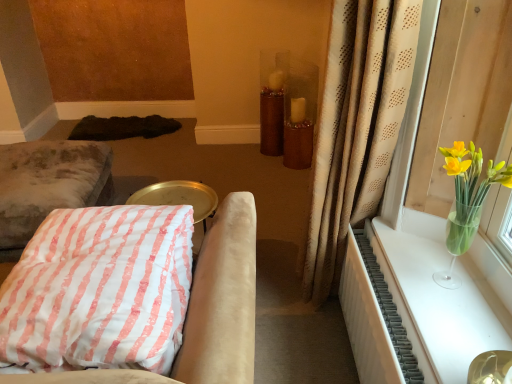
Locate an element on the screen. The height and width of the screenshot is (384, 512). brown glittery vase at center is located at coordinates (271, 121).

What do you see at coordinates (467, 200) in the screenshot?
I see `translucent glass vase at upper right` at bounding box center [467, 200].

Describe the element at coordinates (418, 309) in the screenshot. I see `white textured radiator at right` at that location.

Identify the location of beige dotted curtain at right. (357, 126).

From a real-world perspective, is translucent glass vase at upper right under dark brown shaggy rug at lower left?

No, from a real-world perspective, translucent glass vase at upper right is not beneath dark brown shaggy rug at lower left.

Looking at the image, does translucent glass vase at upper right seem bigger or smaller compared to dark brown shaggy rug at lower left?

Clearly, translucent glass vase at upper right is smaller in size than dark brown shaggy rug at lower left.

How many degrees apart are the facing directions of translucent glass vase at upper right and dark brown shaggy rug at lower left?

They differ by 86.5 degrees in their facing directions.

Is dark brown shaggy rug at lower left completely or partially inside translucent glass vase at upper right?

No, translucent glass vase at upper right does not contain dark brown shaggy rug at lower left.

Considering the relative positions of dark brown shaggy rug at lower left and pink striped fabric cushion at lower left, which is counted as the second furniture, starting from the back, in the image provided, is dark brown shaggy rug at lower left to the right of pink striped fabric cushion at lower left, which is counted as the second furniture, starting from the back, from the viewer's perspective?

No, dark brown shaggy rug at lower left is not to the right of pink striped fabric cushion at lower left, which is counted as the second furniture, starting from the back.

Is dark brown shaggy rug at lower left taller than pink striped fabric cushion at lower left, which is counted as the second furniture, starting from the back?

Incorrect, the height of dark brown shaggy rug at lower left is not larger of that of pink striped fabric cushion at lower left, which is counted as the second furniture, starting from the back.

Is dark brown shaggy rug at lower left positioned beyond the bounds of pink striped fabric cushion at lower left, the first furniture when ordered from right to left?

Absolutely, dark brown shaggy rug at lower left is external to pink striped fabric cushion at lower left, the first furniture when ordered from right to left.

Which object is thinner, dark brown shaggy rug at lower left or pink striped fabric cushion at lower left, which is the second furniture from left to right?

pink striped fabric cushion at lower left, which is the second furniture from left to right.

Identify the location of mat lying above the translucent glass vase at upper right (from the image's perspective). The image size is (512, 384). (123, 127).

From the image's perspective, which is above, dark brown shaggy rug at lower left or translucent glass vase at upper right?

From the image's view, dark brown shaggy rug at lower left is above.

Which of these two, dark brown shaggy rug at lower left or translucent glass vase at upper right, is smaller?

translucent glass vase at upper right.

Considering the positions of objects dark brown shaggy rug at lower left and translucent glass vase at upper right in the image provided, who is more to the left, dark brown shaggy rug at lower left or translucent glass vase at upper right?

From the viewer's perspective, dark brown shaggy rug at lower left appears more on the left side.

Is beige dotted curtain at right to the right of pink striped fabric cushion at lower left, the first furniture when ordered from right to left, from the viewer's perspective?

Correct, you'll find beige dotted curtain at right to the right of pink striped fabric cushion at lower left, the first furniture when ordered from right to left.

Is beige dotted curtain at right touching pink striped fabric cushion at lower left, which is the second furniture from left to right?

No, beige dotted curtain at right is not in contact with pink striped fabric cushion at lower left, which is the second furniture from left to right.

Considering the points (353, 63) and (117, 377), which point is in front, point (353, 63) or point (117, 377)?

The point (117, 377) is more forward.

Which object is thinner, beige dotted curtain at right or pink striped fabric cushion at lower left, the first furniture when ordered from right to left?

Thinner between the two is beige dotted curtain at right.

Which of these two, white textured radiator at right or dark brown shaggy rug at lower left, is thinner?

Thinner between the two is white textured radiator at right.

From a real-world perspective, is white textured radiator at right on dark brown shaggy rug at lower left?

Yes.

Is dark brown shaggy rug at lower left completely or partially inside white textured radiator at right?

No, dark brown shaggy rug at lower left is located outside of white textured radiator at right.

Considering the relative sizes of white textured radiator at right and dark brown shaggy rug at lower left in the image provided, is white textured radiator at right smaller than dark brown shaggy rug at lower left?

Yes, white textured radiator at right is smaller than dark brown shaggy rug at lower left.

From a real-world perspective, does translucent glass vase at upper right sit lower than beige dotted curtain at right?

No, from a real-world perspective, translucent glass vase at upper right is not beneath beige dotted curtain at right.

This screenshot has width=512, height=384. In order to click on floral arrangement in front of the beige dotted curtain at right in this screenshot , I will do `click(467, 200)`.

From the image's perspective, does translucent glass vase at upper right appear lower than beige dotted curtain at right?

Indeed, from the image's perspective, translucent glass vase at upper right is shown beneath beige dotted curtain at right.

Which object is wider, translucent glass vase at upper right or beige dotted curtain at right?

With larger width is beige dotted curtain at right.

Are translucent glass vase at upper right and pink striped fabric cushion at lower left, the first furniture in the front-to-back sequence, making contact?

No, translucent glass vase at upper right is not next to pink striped fabric cushion at lower left, the first furniture in the front-to-back sequence.

From the picture: Is translucent glass vase at upper right to the left or to the right of pink striped fabric cushion at lower left, the first furniture in the front-to-back sequence, in the image?

Clearly, translucent glass vase at upper right is on the right of pink striped fabric cushion at lower left, the first furniture in the front-to-back sequence, in the image.

Could you tell me if translucent glass vase at upper right is facing pink striped fabric cushion at lower left, the first furniture when ordered from right to left?

Yes, translucent glass vase at upper right is facing pink striped fabric cushion at lower left, the first furniture when ordered from right to left.

Who is shorter, translucent glass vase at upper right or pink striped fabric cushion at lower left, the first furniture when ordered from right to left?

pink striped fabric cushion at lower left, the first furniture when ordered from right to left.

Locate an element on the screen. floral arrangement located in front of the dark brown shaggy rug at lower left is located at coordinates (467, 200).

The width and height of the screenshot is (512, 384). Identify the location of the 2nd furniture below the dark brown shaggy rug at lower left (from the image's perspective). (205, 310).

From the image, which object appears to be nearer to beige dotted curtain at right, white textured radiator at right or translucent glass vase at upper right?

translucent glass vase at upper right lies closer to beige dotted curtain at right than the other object.

Which object lies further to the anchor point white textured radiator at right, velvet cushion at left, the second furniture when ordered from right to left, or pink striped fabric cushion at lower left, which is the second furniture from left to right?

The object further to white textured radiator at right is velvet cushion at left, the second furniture when ordered from right to left.

From the image, which object appears to be nearer to pink striped fabric cushion at lower left, the first furniture when ordered from right to left, beige dotted curtain at right or translucent glass vase at upper right?

The object closer to pink striped fabric cushion at lower left, the first furniture when ordered from right to left, is beige dotted curtain at right.

From the image, which object appears to be farther from white textured radiator at right, pink striped fabric cushion at lower left, the first furniture in the front-to-back sequence, or translucent glass vase at upper right?

The object further to white textured radiator at right is pink striped fabric cushion at lower left, the first furniture in the front-to-back sequence.

When comparing their distances from white textured radiator at right, does dark brown shaggy rug at lower left or beige dotted curtain at right seem further?

dark brown shaggy rug at lower left.

Estimate the real-world distances between objects in this image. Which object is further from white textured radiator at right, translucent glass vase at upper right or velvet cushion at left, placed as the second furniture when sorted from front to back?

Among the two, velvet cushion at left, placed as the second furniture when sorted from front to back, is located further to white textured radiator at right.

Considering their positions, is dark brown shaggy rug at lower left positioned closer to brown glittery vase at center than beige dotted curtain at right?

Among the two, dark brown shaggy rug at lower left is located nearer to brown glittery vase at center.

When comparing their distances from beige dotted curtain at right, does translucent glass vase at upper right or velvet cushion at left, the second furniture when ordered from right to left, seem further?

velvet cushion at left, the second furniture when ordered from right to left, lies further to beige dotted curtain at right than the other object.

At what (x,y) coordinates should I click in order to perform the action: click on curtain located between white textured radiator at right and brown glittery vase at center in the depth direction. Please return your answer as a coordinate pair (x, y). The width and height of the screenshot is (512, 384). Looking at the image, I should click on (357, 126).

Where is `curtain located between translucent glass vase at upper right and brown glittery vase at center in the depth direction`? The width and height of the screenshot is (512, 384). curtain located between translucent glass vase at upper right and brown glittery vase at center in the depth direction is located at coordinates (357, 126).

This screenshot has height=384, width=512. What are the coordinates of `curtain between pink striped fabric cushion at lower left, the first furniture when ordered from right to left, and dark brown shaggy rug at lower left in the front-back direction` in the screenshot? It's located at [357, 126].

Locate an element on the screen. The width and height of the screenshot is (512, 384). candle holder located between white textured radiator at right and dark brown shaggy rug at lower left in the depth direction is located at coordinates (x=271, y=121).